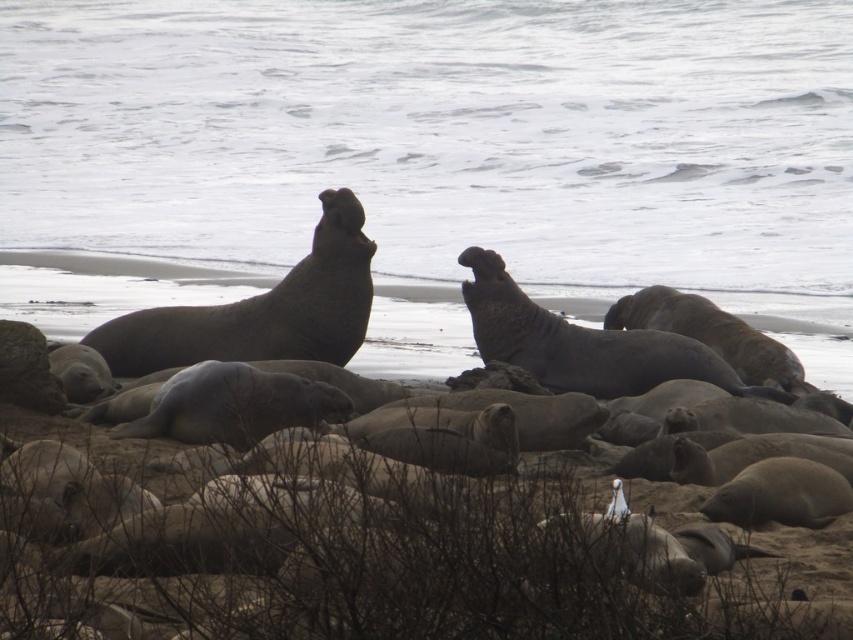
Between point (509, 323) and point (775, 374), which one is positioned behind?

The point (509, 323) is behind.

Measure the distance between point (512, 333) and camera.

Point (512, 333) is 41.37 feet away from camera.

Find the location of `gray textured seal at center`. gray textured seal at center is located at coordinates (582, 342).

Who is more forward, (106, 316) or (659, 369)?

Point (659, 369) is in front.

Is brown sandy beach at center thinner than gray textured seal at center?

No.

Who is more forward, (840, 532) or (625, 339)?

Point (840, 532)

Locate an element on the screen. brown sandy beach at center is located at coordinates (90, 296).

Does gray matte seal at upper left have a smaller size compared to gray matte seal at center?

Actually, gray matte seal at upper left might be larger than gray matte seal at center.

Between point (364, 330) and point (680, 333), which one is positioned in front?

Positioned in front is point (364, 330).

The width and height of the screenshot is (853, 640). Identify the location of gray matte seal at upper left. (262, 308).